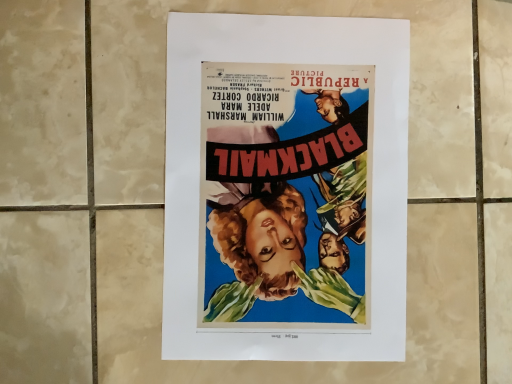
Where is `vacant area on top of vibrant paper poster at center (from a real-world perspective)`? This screenshot has height=384, width=512. vacant area on top of vibrant paper poster at center (from a real-world perspective) is located at coordinates point(290,188).